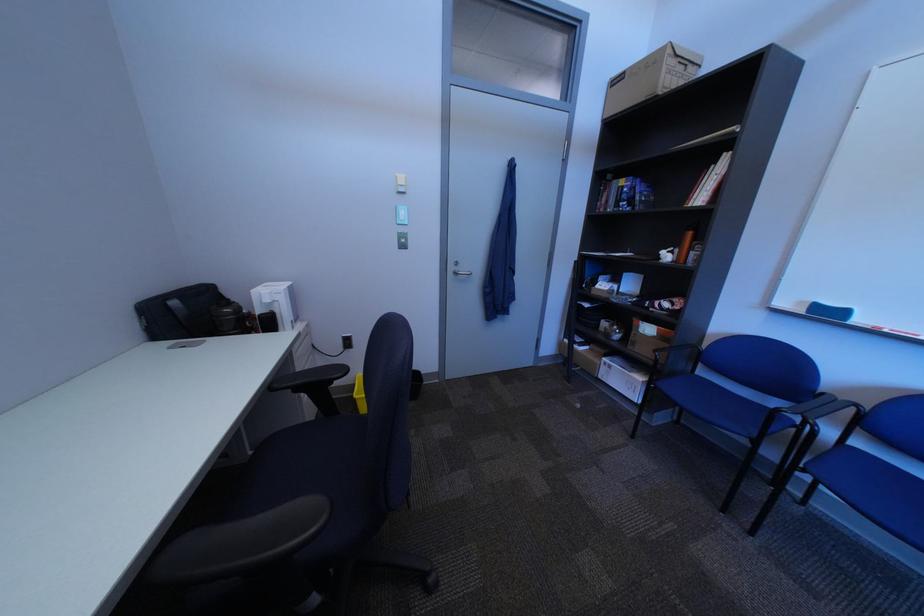
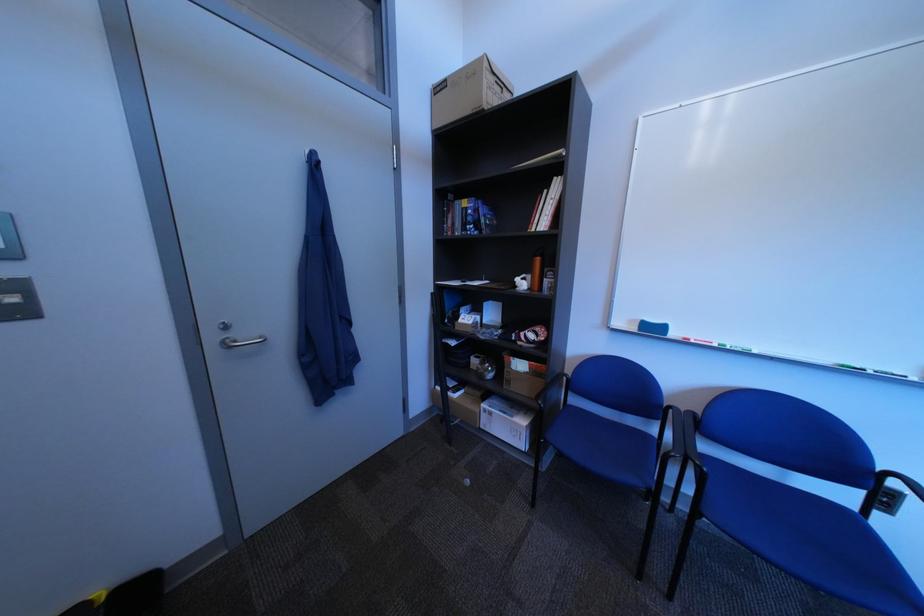
Question: I am providing you with two images of the same scene from different viewpoints. Please identify which objects are invisible in image2.

Choices:
 (A) door hook
 (B) white box
 (C) silver door handle
 (D) none of these

Answer: (D)